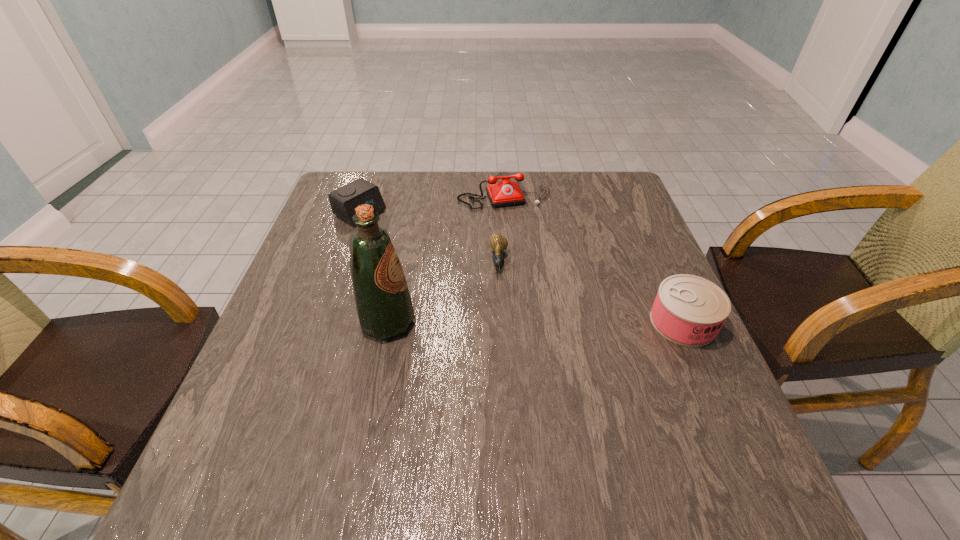
Where is `vacant area that satisfies the following two spatial constraints: 1. on the front side of the third nearest object; 2. on the left side of the alarm clock`? This screenshot has height=540, width=960. vacant area that satisfies the following two spatial constraints: 1. on the front side of the third nearest object; 2. on the left side of the alarm clock is located at coordinates (344, 261).

This screenshot has height=540, width=960. I want to click on free space that satisfies the following two spatial constraints: 1. on the back side of the leftmost object; 2. on the left side of the telephone, so click(x=368, y=192).